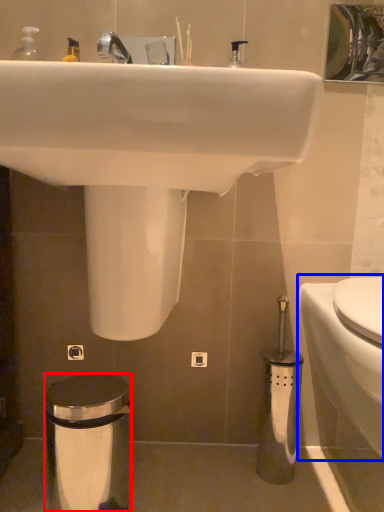
Question: Which of the following is the farthest to the observer, trash bin/can (highlighted by a red box) or toilet (highlighted by a blue box)?

Choices:
 (A) trash bin/can
 (B) toilet

Answer: (A)